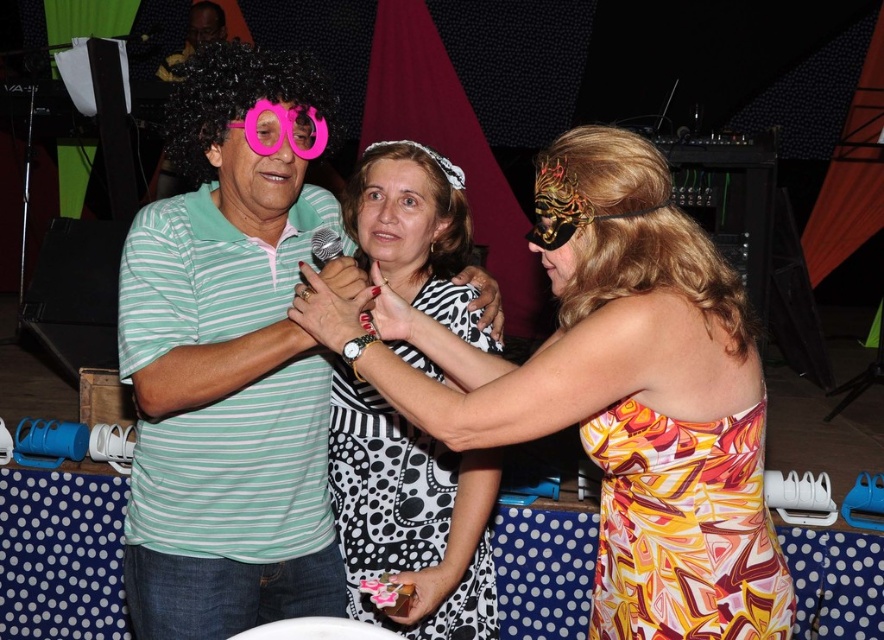
Looking at this image, you are a photographer positioned at the front of the stage. You need to take a photo that clearly shows both the black and white polka dot dress at center and the black dotted fabric dress at center. Which dress should you focus on to ensure both are in focus?

You should focus on the black and white polka dot dress at center because it is closer to the viewer, so focusing on it will keep both dresses in focus due to the depth of field.

You are a stagehand who needs to adjust the distance between the green striped shirt at center and the pink plastic goggles at center to exactly 12 inches. Currently, they are 13.57 inches apart. What should you do?

The current distance between the green striped shirt at center and the pink plastic goggles at center is 13.57 inches. To reduce it to 12 inches, you should move them closer together by approximately 1.57 inches.

You are standing at the point closest to the camera in this image. Which of the two points, point (321, 305) or point (295, 125), are you currently at?

You are at point (321, 305) because it is closer to the camera than point (295, 125).